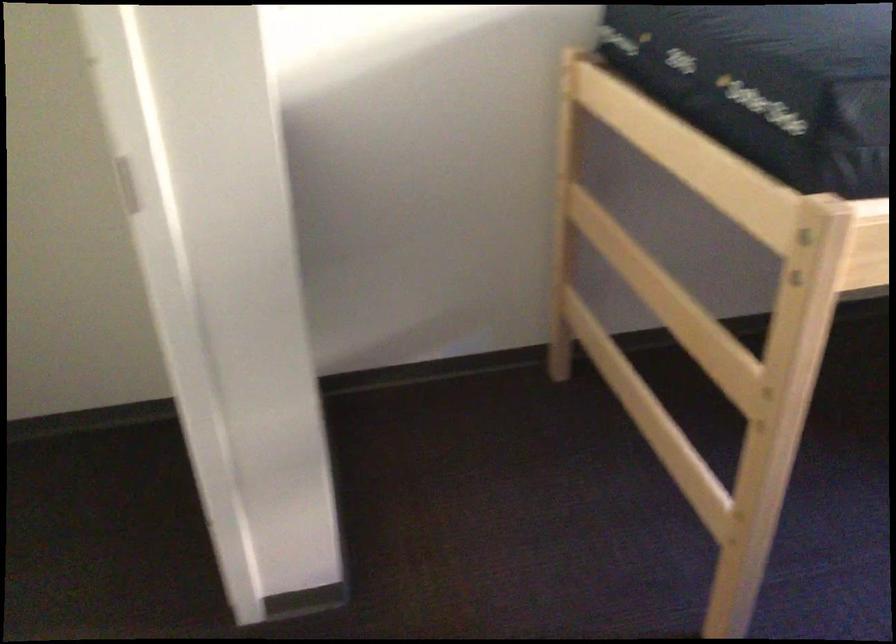
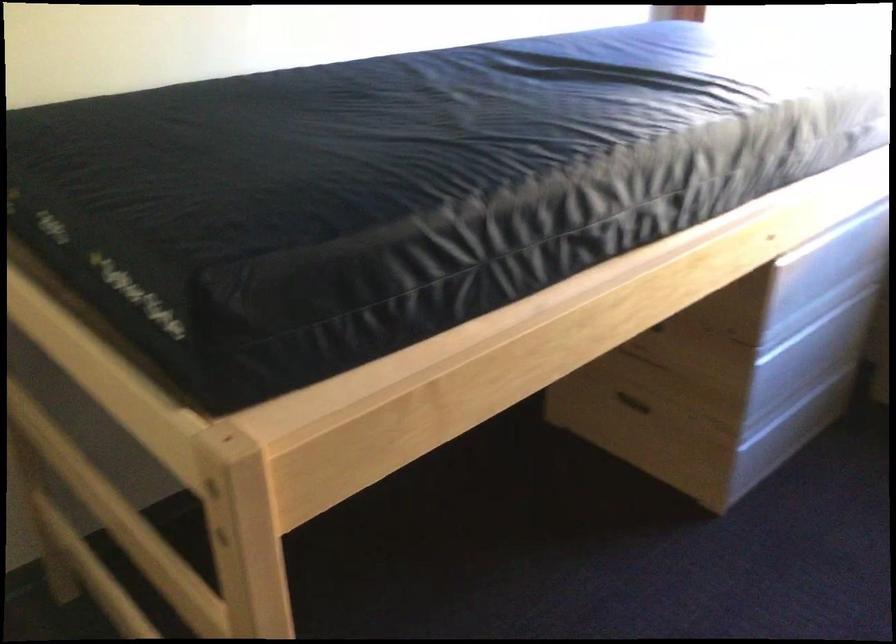
Where in the second image is the point corresponding to the point at 539,373 from the first image?

(44, 608)